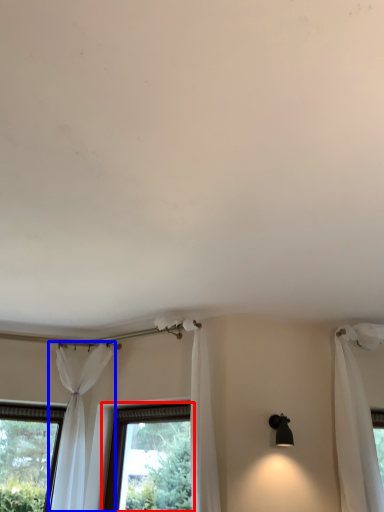
Question: Which object appears closest to the camera in this image, window (highlighted by a red box) or curtain (highlighted by a blue box)?

Choices:
 (A) window
 (B) curtain

Answer: (B)